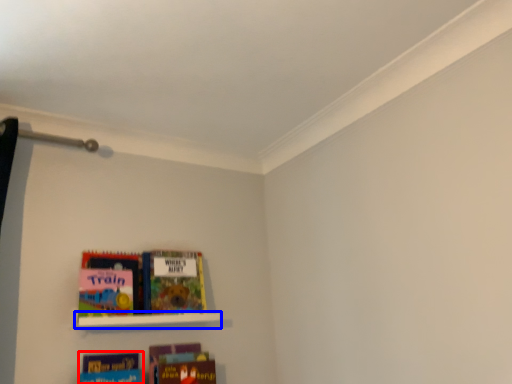
Question: Which point is closer to the camera, book (highlighted by a red box) or shelf (highlighted by a blue box)?

Choices:
 (A) book
 (B) shelf

Answer: (A)